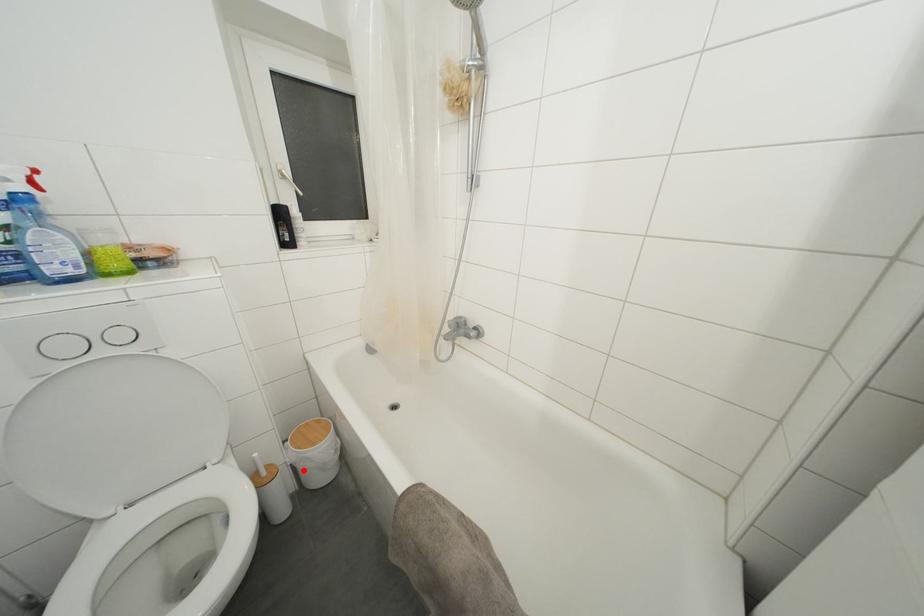
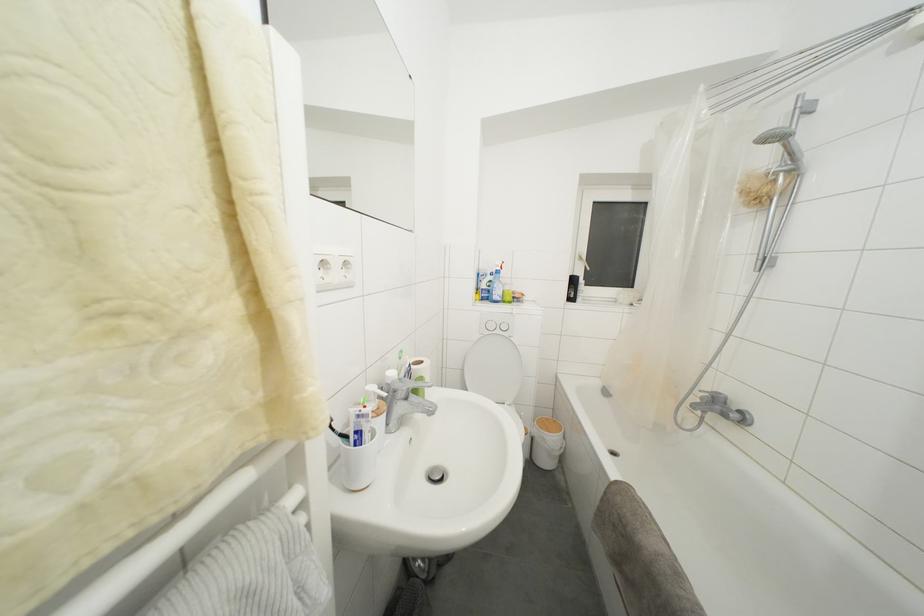
Where in the second image is the point corresponding to the highlighted location from the first image?

(541, 445)